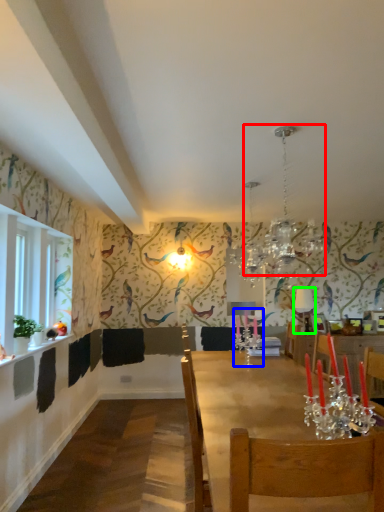
Question: Which object is the farthest from light fixture (highlighted by a red box)? Choose among these: candle holder (highlighted by a blue box) or lamp (highlighted by a green box).

Choices:
 (A) candle holder
 (B) lamp

Answer: (A)